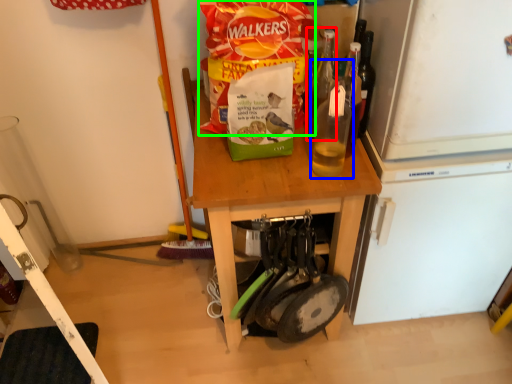
Question: Which is farther away from bottle (highlighted by a red box)? bottle (highlighted by a blue box) or cereal (highlighted by a green box)?

Choices:
 (A) bottle
 (B) cereal

Answer: (B)